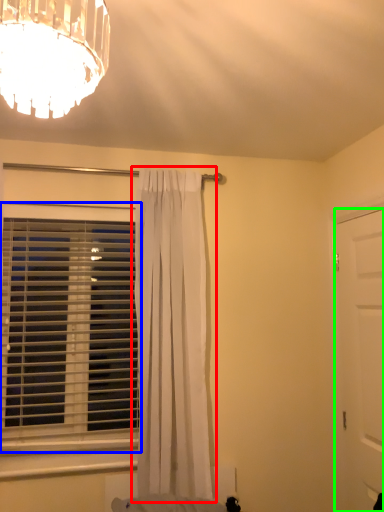
Question: Which object is positioned farthest from curtain (highlighted by a red box)? Select from window blind (highlighted by a blue box) and door (highlighted by a green box).

Choices:
 (A) window blind
 (B) door

Answer: (B)